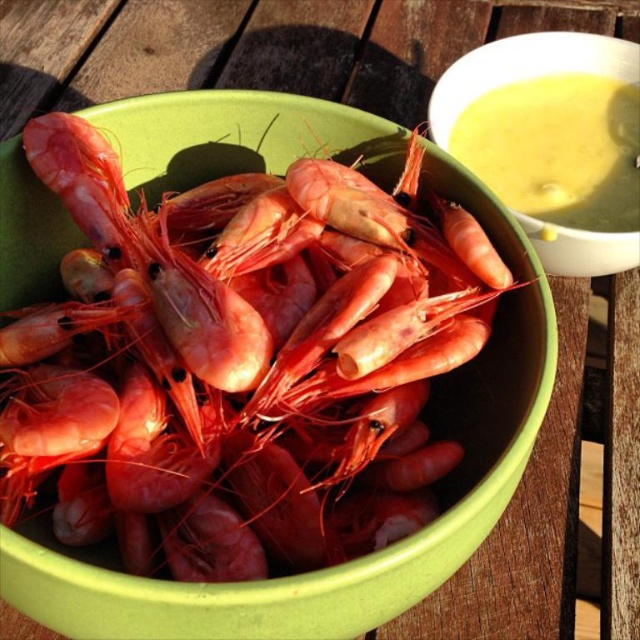
You are planning to take a photo of the glossy pink shrimp at center and the yellow creamy soup at upper right. Since you want both to be in focus, you need to know which one is taller. Can you tell me which one is taller?

The glossy pink shrimp at center has a greater height compared to the yellow creamy soup at upper right, so the glossy pink shrimp at center is taller.

In the scene shown: You are at the table where the bowl of cooked prawns is placed. There are two points marked on the table. One is at coordinate point (308, 544) and the other is at point (540, 122). If you want to place a napkin closer to the point that is in front, which coordinate should you choose?

You should choose point (308, 544) because it is in front of point (540, 122).

You are a chef preparing a dish and need to place a garnish exactly at point (x=237, y=330) on the image. Where should you place the garnish?

The point (x=237, y=330) is on the glossy pink shrimp at center, so you should place the garnish on the glossy pink shrimp at center.